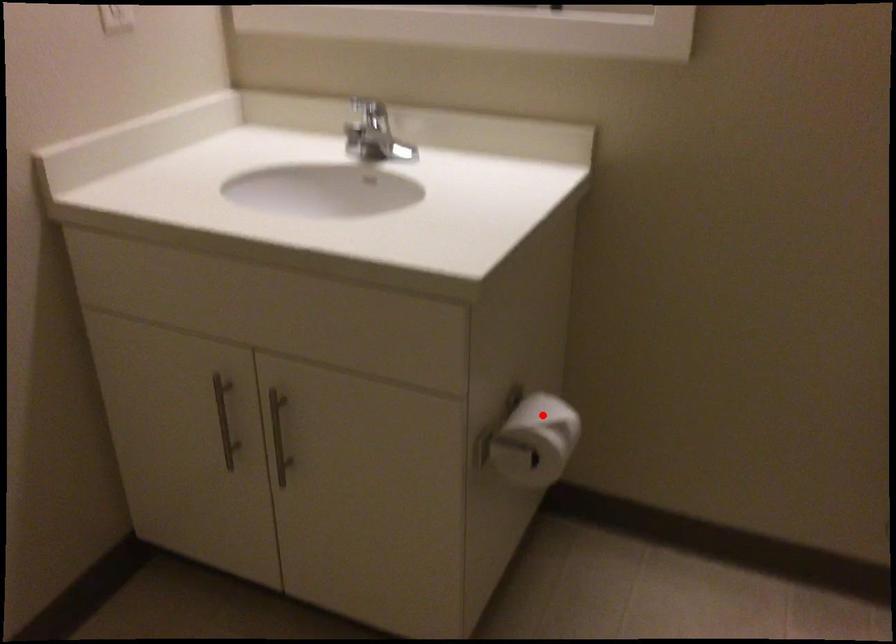
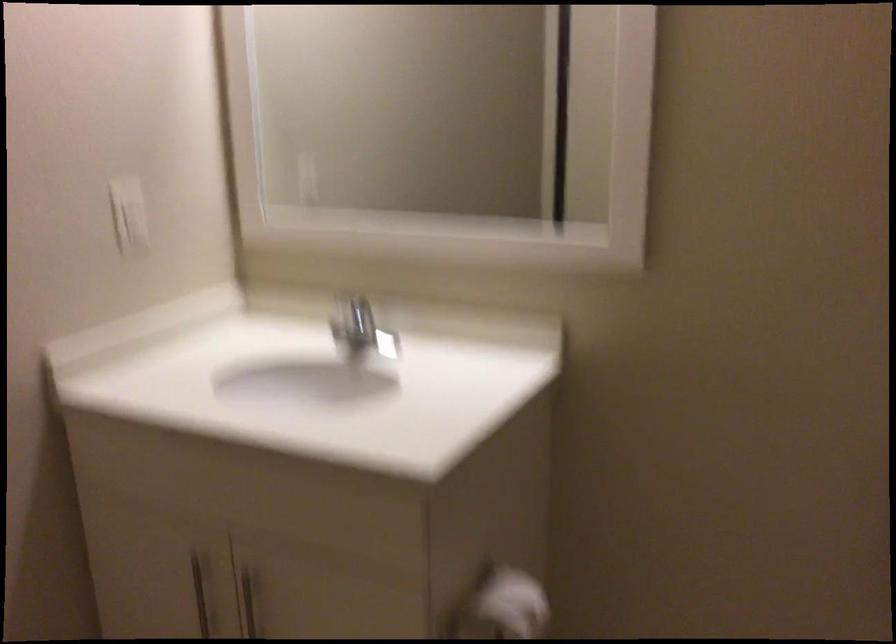
Question: I am providing you with two images of the same scene from different viewpoints. A red point is marked on the first image. Is the red point's position out of view in image 2?

Choices:
 (A) Yes
 (B) No

Answer: (B)